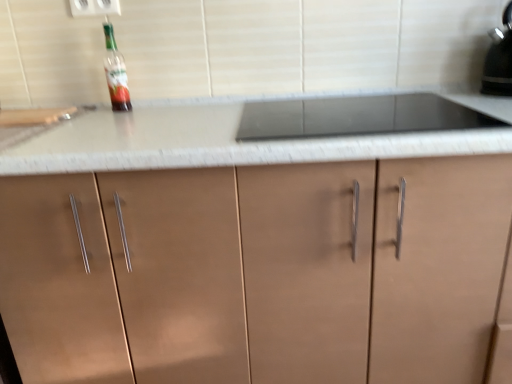
In order to click on vacant space that is to the left of black glossy kettle at upper right in this screenshot , I will do `click(457, 94)`.